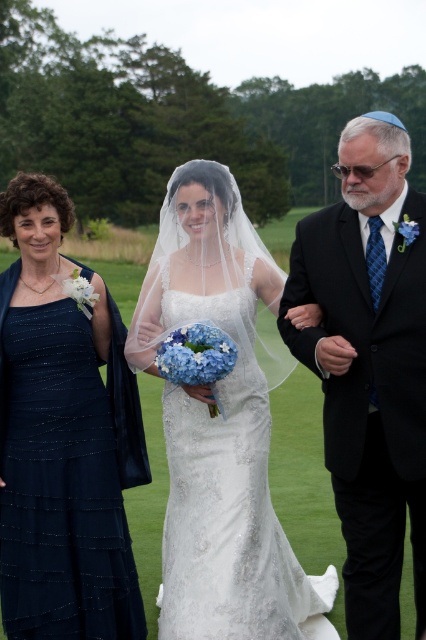
Is point (259, 611) positioned in front of point (126, 608)?

Yes, point (259, 611) is in front of point (126, 608).

Where is `white lace dress at center`? Image resolution: width=426 pixels, height=640 pixels. white lace dress at center is located at coordinates (221, 428).

Between point (328, 595) and point (382, 500), which one is positioned behind?

The point (328, 595) is more distant.

Which of these two, white lace dress at center or black satin suit at right, stands taller?

white lace dress at center is taller.

Where is `white lace dress at center`? Image resolution: width=426 pixels, height=640 pixels. white lace dress at center is located at coordinates (221, 428).

Image resolution: width=426 pixels, height=640 pixels. Identify the location of white lace dress at center. (221, 428).

Does point (104, 451) come behind point (370, 388)?

Yes, point (104, 451) is farther from viewer.

Is navy satin dress at left positioned before black satin suit at right?

That is False.

Between point (32, 352) and point (319, 230), which one is positioned in front?

Point (319, 230) is in front.

You are a GUI agent. You are given a task and a screenshot of the screen. Output one action in this format:
    pyautogui.click(x=<x>, y=<y>)
    Task: Click on the navy satin dress at left
    
    Given the screenshot: What is the action you would take?
    pyautogui.click(x=63, y=438)